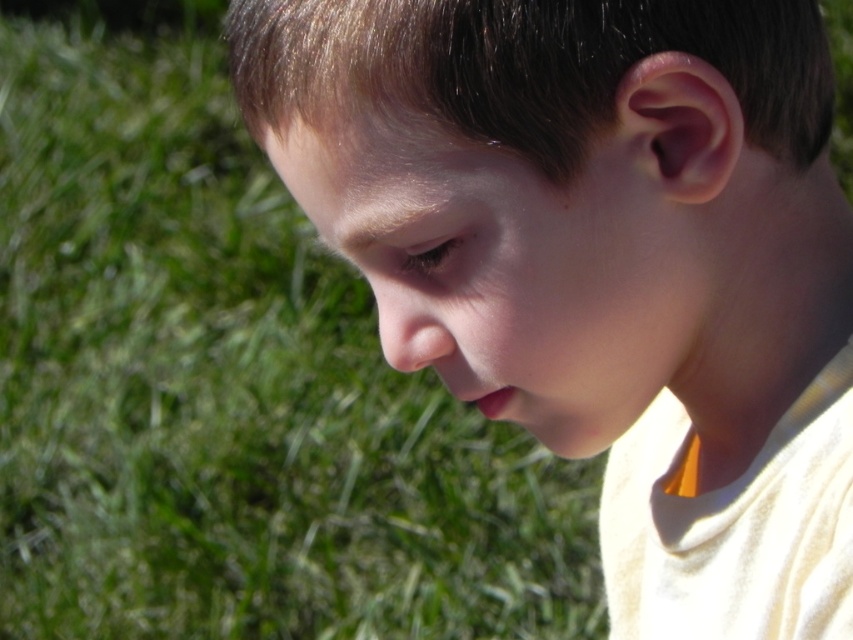
You are a photographer holding a camera with a 100mm lens. You want to capture a close portrait of the smooth skin face at center. The minimum focusing distance for your lens is 1 meter. Can you take the photo without moving closer?

The smooth skin face at center is 22.67 inches away from the viewer. Since 22.67 inches is approximately 0.576 meters, which is less than the lens minimum focusing distance of 1 meter, you cannot take the photo without moving further back.

Looking at the image, where is the smooth skin face at center in relation to the green grass at lower left?

The smooth skin face at center is to the right of the green grass at lower left.

Based on the scene description, can you determine which object, the smooth skin face at center or the green grass at lower left, appears taller in the image?

The green grass at lower left appears taller than the smooth skin face at center in the image.